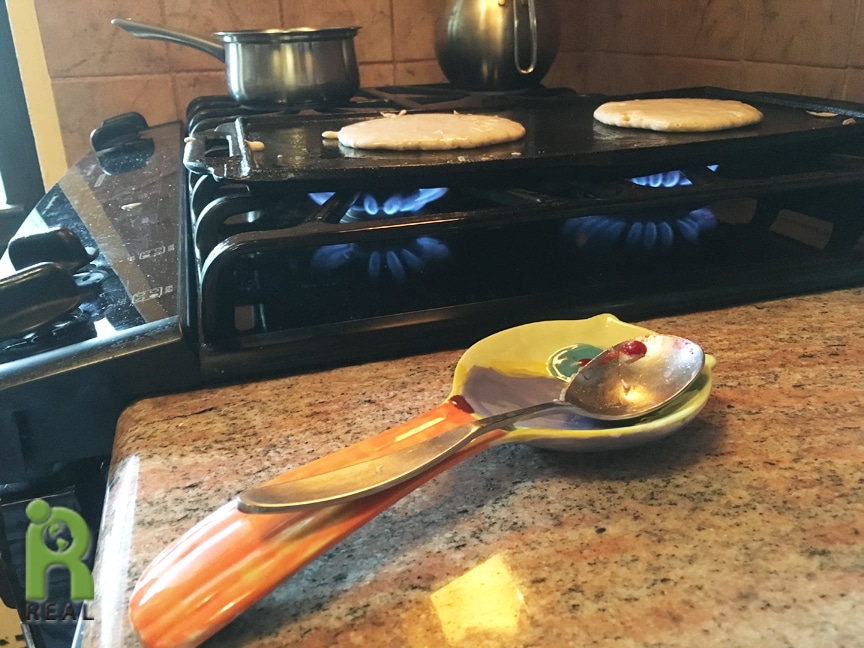
Find the location of a particular element. This screenshot has height=648, width=864. kettle is located at coordinates (497, 47).